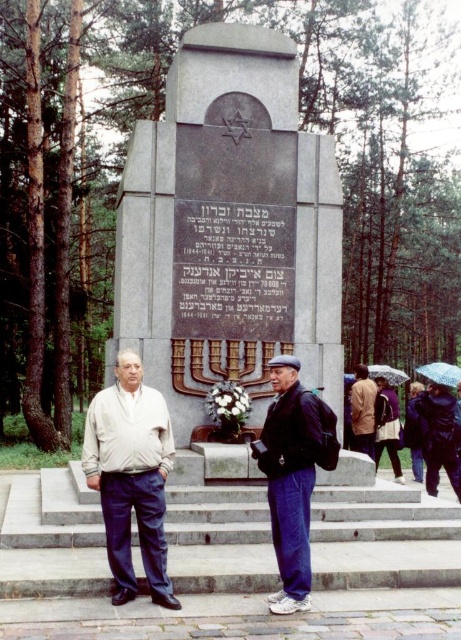
Question: Can you confirm if brown leather jacket at center is positioned to the right of transparent plastic umbrella at upper right?

Choices:
 (A) yes
 (B) no

Answer: (B)

Question: Considering the real-world distances, which object is farthest from the polished granite stone at center?

Choices:
 (A) light beige sweater at center
 (B) transparent plastic umbrella at center

Answer: (B)

Question: Is dark gray fabric jacket at center thinner than transparent plastic umbrella at upper right?

Choices:
 (A) yes
 (B) no

Answer: (A)

Question: Among these objects, which one is farthest from the camera?

Choices:
 (A) dark gray fabric jacket at center
 (B) transparent plastic umbrella at center

Answer: (B)

Question: Does light beige sweater at center have a smaller size compared to dark gray fabric jacket at center?

Choices:
 (A) yes
 (B) no

Answer: (B)

Question: Based on their relative distances, which object is farther from the dark gray fabric jacket at center?

Choices:
 (A) transparent plastic umbrella at upper right
 (B) brown leather jacket at center

Answer: (A)